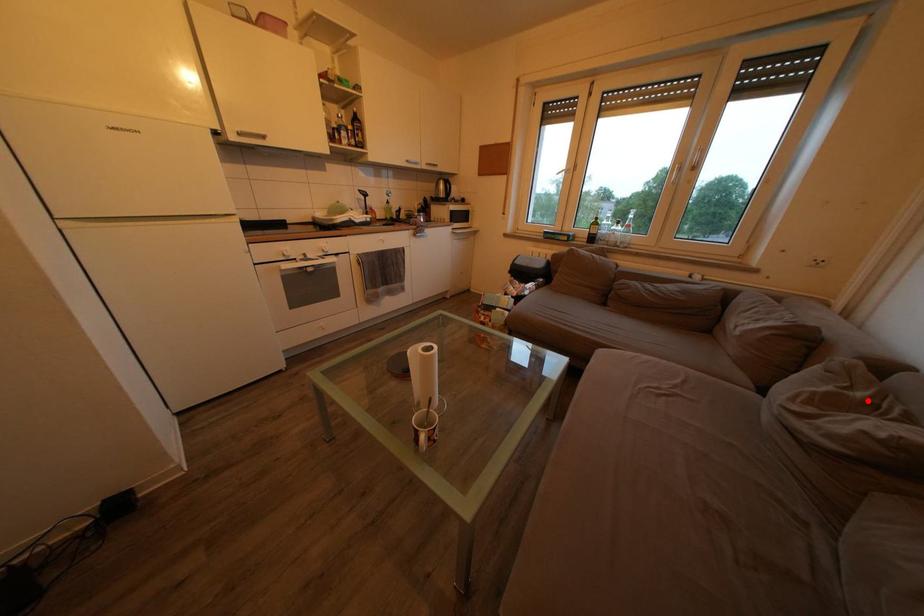
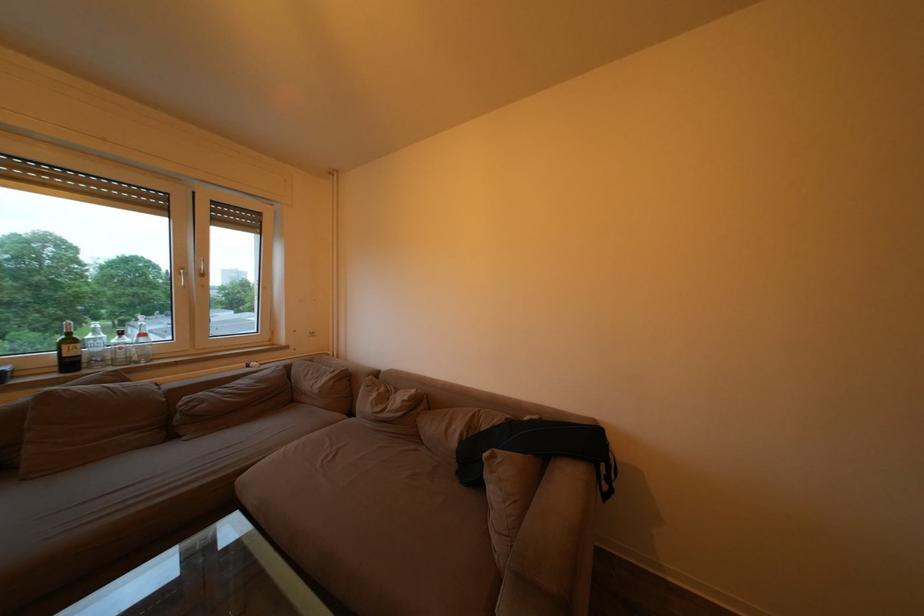
Question: I am providing you with two images of the same scene from different viewpoints. Given a red point in image1, look at the same physical point in image2. Is it:

Choices:
 (A) Closer to the viewpoint
 (B) Farther from the viewpoint

Answer: (A)